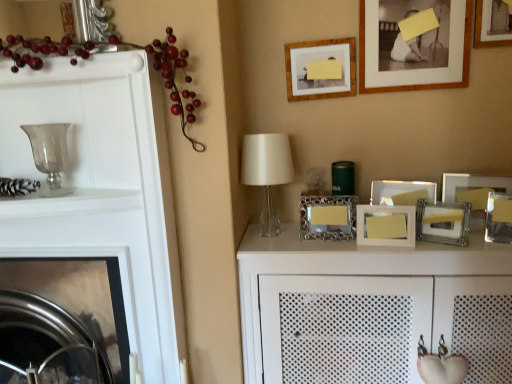
Identify the location of vacant space situated on the left part of wooden picture frame at center-right, which is the first picture frame in bottom-to-top order. Image resolution: width=512 pixels, height=384 pixels. (340, 247).